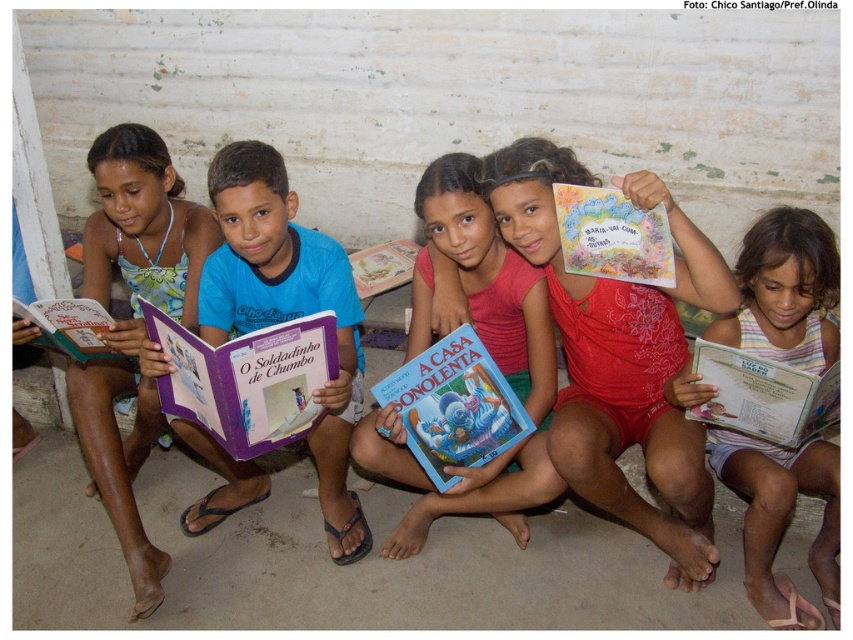
Can you confirm if blue paper book at center is positioned to the left of matte colorful book at center?

Indeed, blue paper book at center is positioned on the left side of matte colorful book at center.

Does blue paper book at center have a greater width compared to matte colorful book at center?

Yes, blue paper book at center is wider than matte colorful book at center.

I want to click on blue paper book at center, so click(454, 406).

Can you confirm if hardcover book at left is positioned below hardcover book at center?

Correct, hardcover book at left is located below hardcover book at center.

Is point (44, 314) closer to viewer compared to point (364, 250)?

Yes, point (44, 314) is closer to viewer.

Where is `hardcover book at left`? The image size is (853, 640). hardcover book at left is located at coordinates (68, 324).

Identify the location of hardcover book at left. (68, 324).

Is pink fabric dress at center closer to the viewer compared to white paper book at center?

No, it is not.

Between pink fabric dress at center and white paper book at center, which one has more height?

With more height is pink fabric dress at center.

Who is more distant from viewer, (526, 481) or (746, 394)?

The point (526, 481) is behind.

This screenshot has height=640, width=853. I want to click on pink fabric dress at center, so click(492, 358).